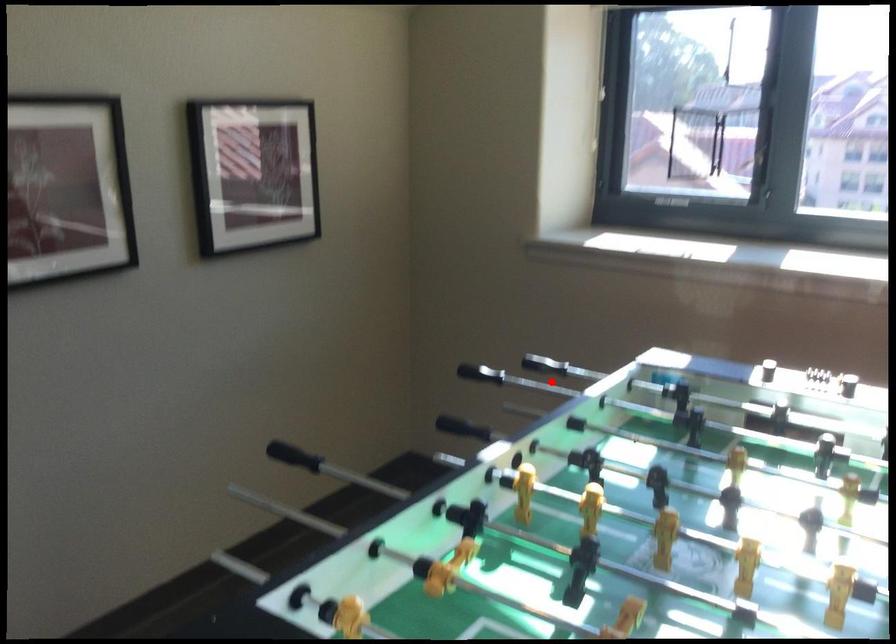
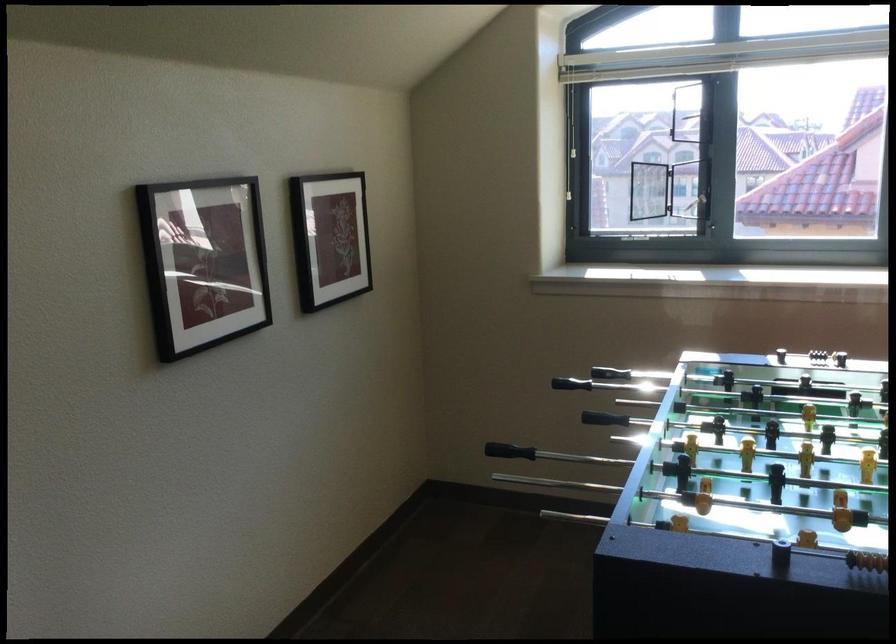
Where in the second image is the point corresponding to the highlighted location from the first image?

(570, 384)